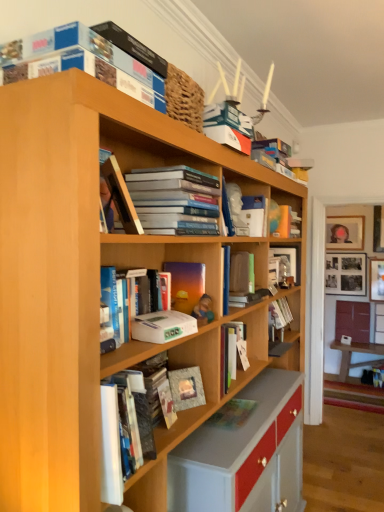
Question: Considering the relative sizes of wooden bookshelf at right and blue cardboard box at upper center, which is counted as the 1th book, starting from the front, in the image provided, is wooden bookshelf at right shorter than blue cardboard box at upper center, which is counted as the 1th book, starting from the front,?

Choices:
 (A) no
 (B) yes

Answer: (A)

Question: Is wooden bookshelf at right not near blue cardboard box at upper center, which is counted as the 1th book, starting from the front?

Choices:
 (A) no
 (B) yes

Answer: (B)

Question: Is wooden bookshelf at right thinner than blue cardboard box at upper center, which is counted as the 1th book, starting from the front?

Choices:
 (A) yes
 (B) no

Answer: (A)

Question: Is wooden bookshelf at right smaller than blue cardboard box at upper center, which appears as the ninth book when viewed from the back?

Choices:
 (A) no
 (B) yes

Answer: (A)

Question: From the image's perspective, is wooden bookshelf at right above blue cardboard box at upper center, which is counted as the 1th book, starting from the front?

Choices:
 (A) yes
 (B) no

Answer: (B)

Question: Is wooden table at lower right inside the boundaries of wooden bookshelf at right, or outside?

Choices:
 (A) inside
 (B) outside

Answer: (B)

Question: In the image, is wooden table at lower right on the left side or the right side of wooden bookshelf at right?

Choices:
 (A) left
 (B) right

Answer: (B)

Question: From a real-world perspective, relative to wooden bookshelf at right, is wooden table at lower right vertically above or below?

Choices:
 (A) below
 (B) above

Answer: (A)

Question: In terms of height, does wooden table at lower right look taller or shorter compared to wooden bookshelf at right?

Choices:
 (A) tall
 (B) short

Answer: (B)

Question: From a real-world perspective, relative to matte black frame at upper center, positioned as the 1th book in back-to-front order, is matte gray paperback book at center, which appears as the first paperback book when ordered from the bottom, vertically above or below?

Choices:
 (A) below
 (B) above

Answer: (A)

Question: From the image's perspective, is matte gray paperback book at center, which is the 1th paperback book from back to front, above or below matte black frame at upper center, the 9th book in the front-to-back sequence?

Choices:
 (A) below
 (B) above

Answer: (A)

Question: Is matte gray paperback book at center, which is the 1th paperback book from back to front, wider or thinner than matte black frame at upper center, positioned as the 1th book in back-to-front order?

Choices:
 (A) thin
 (B) wide

Answer: (A)

Question: In terms of height, does matte gray paperback book at center, which is the 1th paperback book from back to front, look taller or shorter compared to matte black frame at upper center, the 9th book in the front-to-back sequence?

Choices:
 (A) tall
 (B) short

Answer: (B)

Question: From a real-world perspective, is hardcover book at center, the 8th book in the front-to-back sequence, positioned above or below matte gray paperback book at center, which appears as the first paperback book when ordered from the bottom?

Choices:
 (A) below
 (B) above

Answer: (B)

Question: In terms of size, does hardcover book at center, the second book viewed from the back, appear bigger or smaller than matte gray paperback book at center, which is the 2th paperback book from front to back?

Choices:
 (A) small
 (B) big

Answer: (B)